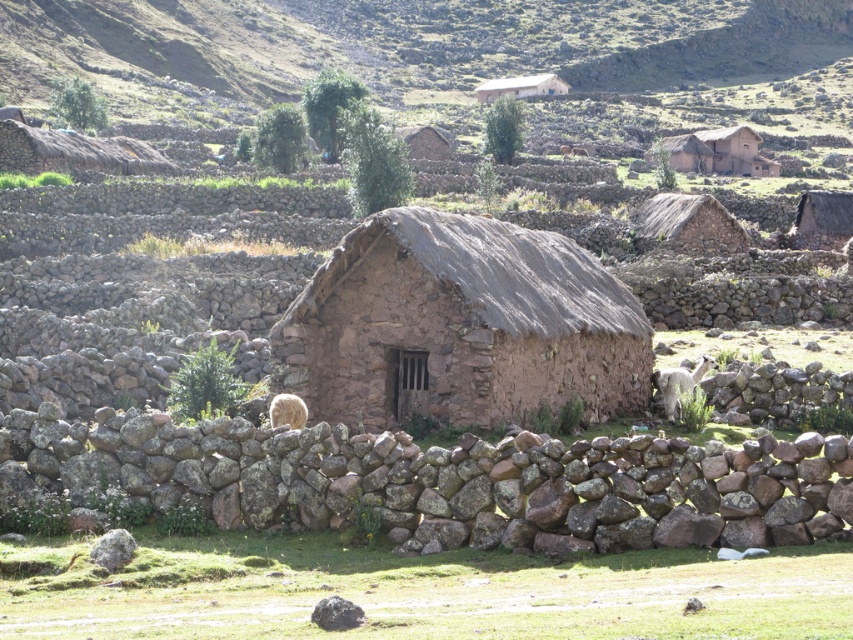
Is thatched straw hut at upper center below brown stone hut at center?

Incorrect, thatched straw hut at upper center is not positioned below brown stone hut at center.

Can you confirm if thatched straw hut at upper center is bigger than brown stone hut at center?

Indeed, thatched straw hut at upper center has a larger size compared to brown stone hut at center.

Is point (714, 138) closer to viewer compared to point (416, 150)?

No, it is behind (416, 150).

Locate an element on the screen. The image size is (853, 640). thatched straw hut at upper center is located at coordinates (718, 152).

Measure the distance from brown mud hut at center to brown stone hut at center.

They are 89.78 meters apart.

Is point (300, 392) positioned behind point (416, 147)?

No.

Where is `brown mud hut at center`? This screenshot has width=853, height=640. brown mud hut at center is located at coordinates (460, 326).

Can you confirm if brown rock wall at center is thinner than rustic stone hut at upper center?

No, brown rock wall at center is not thinner than rustic stone hut at upper center.

You are a GUI agent. You are given a task and a screenshot of the screen. Output one action in this format:
    pyautogui.click(x=<x>, y=<y>)
    Task: Click on the brown rock wall at center
    The image size is (853, 640).
    Given the screenshot: What is the action you would take?
    pyautogui.click(x=444, y=481)